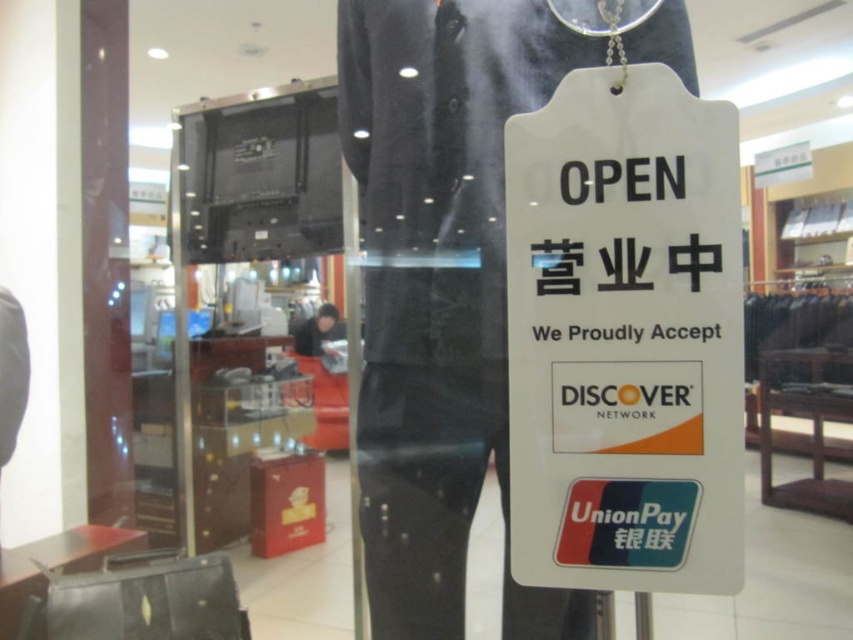
Describe the element at coordinates (625, 337) in the screenshot. The height and width of the screenshot is (640, 853). I see `white paper sign at center` at that location.

Between point (648, 241) and point (403, 205), which one is positioned in front?

Point (648, 241)

Where is `white paper sign at center`? The width and height of the screenshot is (853, 640). white paper sign at center is located at coordinates (625, 337).